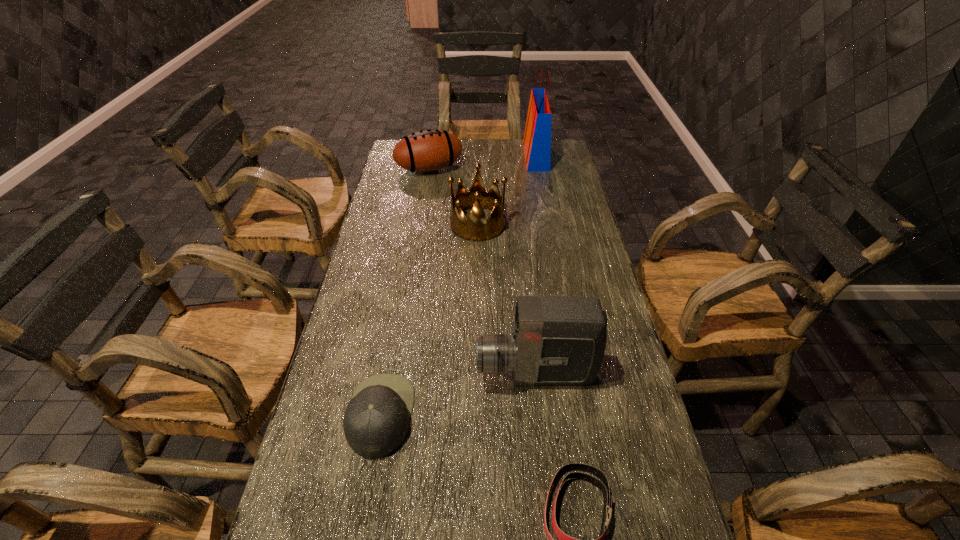
I want to click on object that is the fifth closest to the third shortest object, so click(563, 539).

Identify which object is located as the fifth nearest to the shopping bag. Please provide its 2D coordinates. Your answer should be formatted as a tuple, i.e. [(x, y)], where the tuple contains the x and y coordinates of a point satisfying the conditions above.

[(563, 539)]